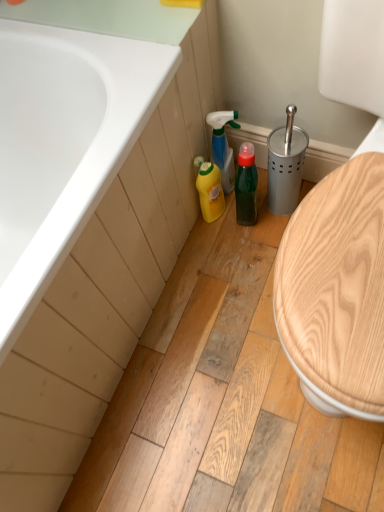
Locate an element on the screen. Image resolution: width=384 pixels, height=512 pixels. vacant space situated on the left part of green matte bottle at center is located at coordinates (216, 244).